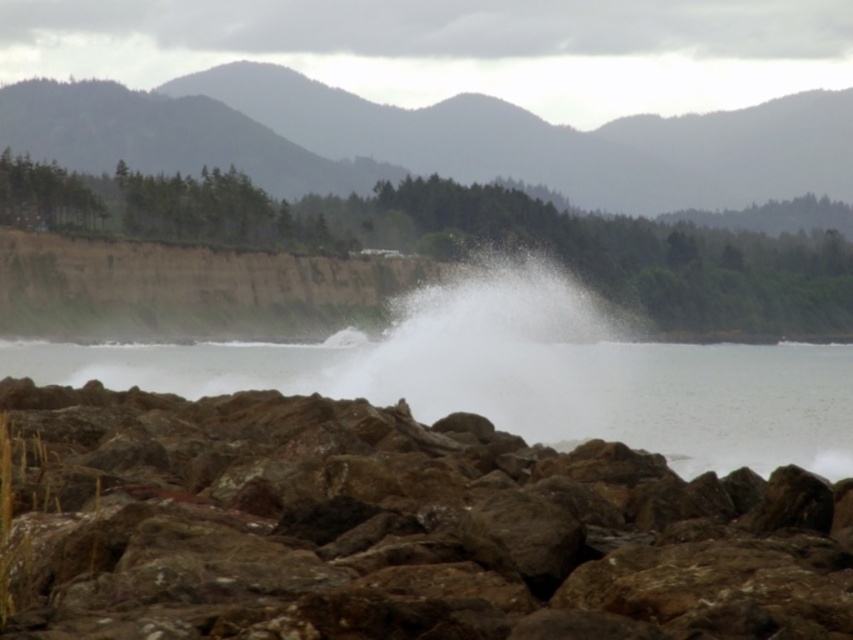
Between brown rough rocks at lower center and white frothy water at center, which one is positioned higher?

white frothy water at center is higher up.

Who is more distant from viewer, (338, 428) or (682, 369)?

Positioned behind is point (682, 369).

Does point (465, 496) come farther from viewer compared to point (821, 372)?

No, it is in front of (821, 372).

Identify the location of brown rough rocks at lower center. (387, 529).